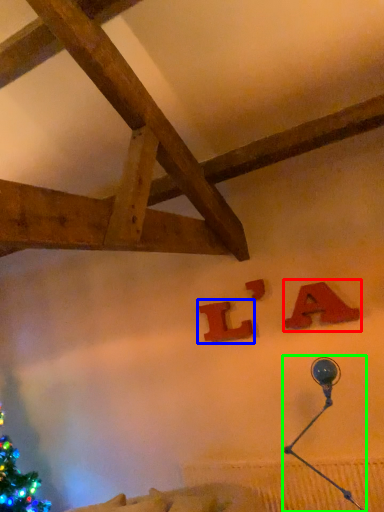
Question: Which object is the farthest from alphabet (highlighted by a red box)? Choose among these: alphabet (highlighted by a blue box) or lamp (highlighted by a green box).

Choices:
 (A) alphabet
 (B) lamp

Answer: (A)